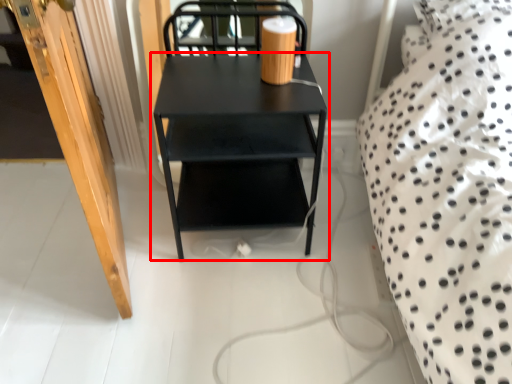
Question: From the image's perspective, what is the correct spatial positioning of table (annotated by the red box) in reference to door?

Choices:
 (A) above
 (B) below

Answer: (B)